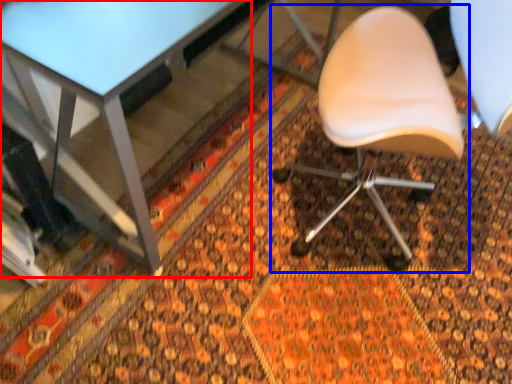
Question: Which object appears closest to the camera in this image, table (highlighted by a red box) or chair (highlighted by a blue box)?

Choices:
 (A) table
 (B) chair

Answer: (B)